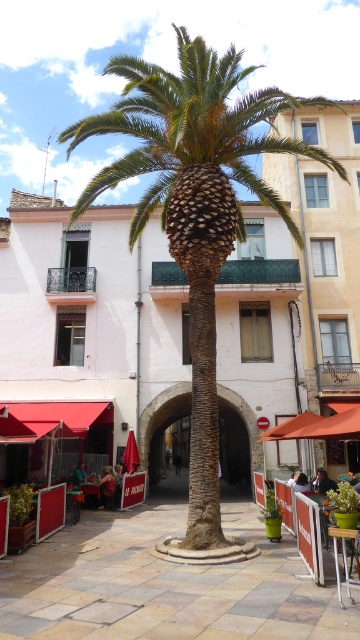
Is brown textured palm tree at center thinner than wooden table at center?

Incorrect, brown textured palm tree at center's width is not less than wooden table at center's.

Is brown textured palm tree at center in front of wooden table at center?

No, brown textured palm tree at center is further to the viewer.

Does point (219, 132) come closer to viewer compared to point (344, 572)?

That is False.

This screenshot has height=640, width=360. What are the coordinates of `brown textured palm tree at center` in the screenshot? It's located at (195, 205).

Which is below, smooth white building at center or wooden table at center?

smooth white building at center is lower down.

Between smooth white building at center and wooden table at center, which one appears on the left side from the viewer's perspective?

smooth white building at center is more to the left.

Which is in front, point (294, 276) or point (348, 582)?

Positioned in front is point (348, 582).

At what (x,y) coordinates should I click in order to perform the action: click on smooth white building at center. Please return your answer as a coordinate pair (x, y). This screenshot has width=360, height=640. Looking at the image, I should click on (91, 326).

This screenshot has height=640, width=360. Find the location of `smooth white building at center`. smooth white building at center is located at coordinates point(91,326).

Is smooth white building at center bigger than brown textured palm tree at center?

No.

Is point (23, 200) positioned after point (154, 150)?

Yes.

Identify the location of smooth white building at center. This screenshot has width=360, height=640. (91, 326).